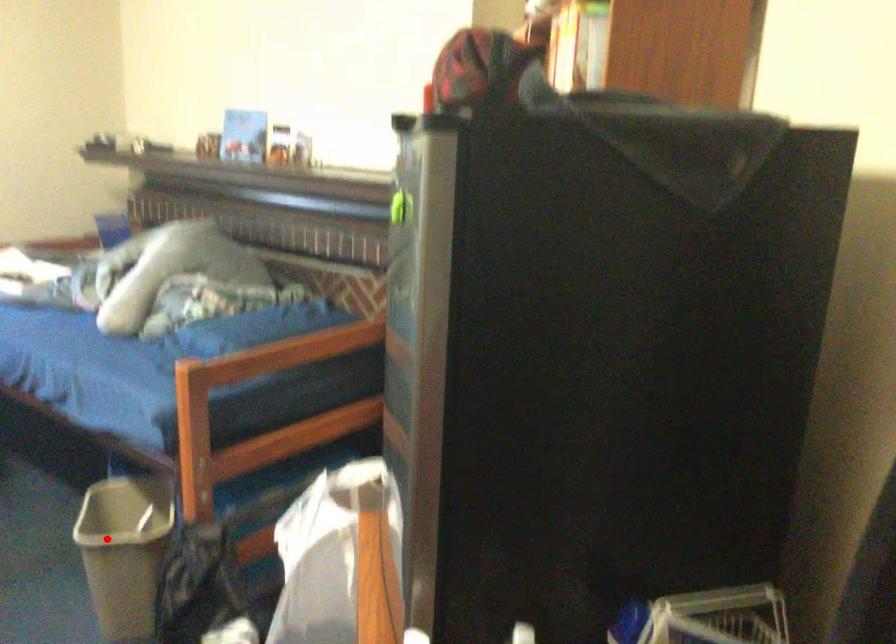
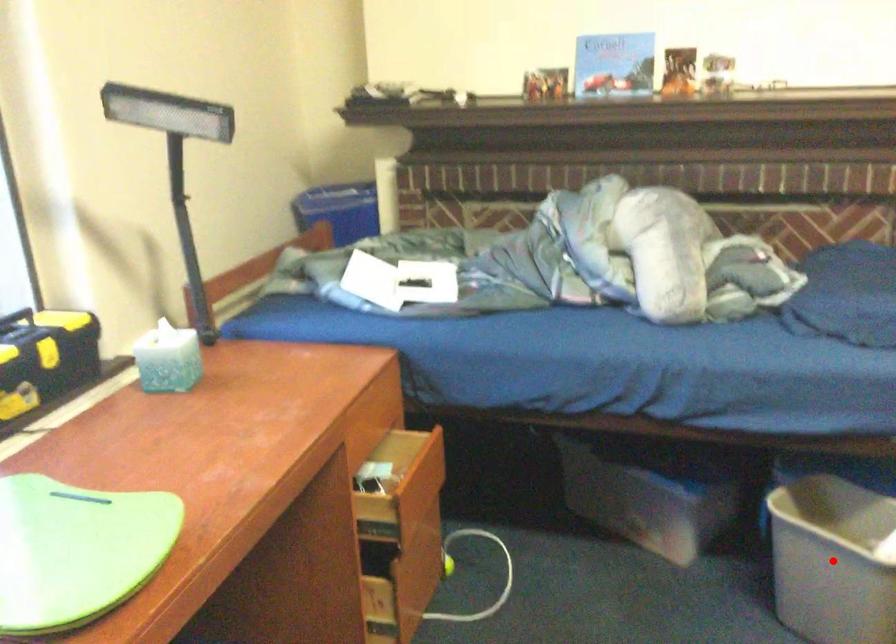
I am providing you with two images of the same scene from different viewpoints. A red point is marked on the first image and another point is marked on the second image. Is the red point in image1 aligned with the point shown in image2?

Yes